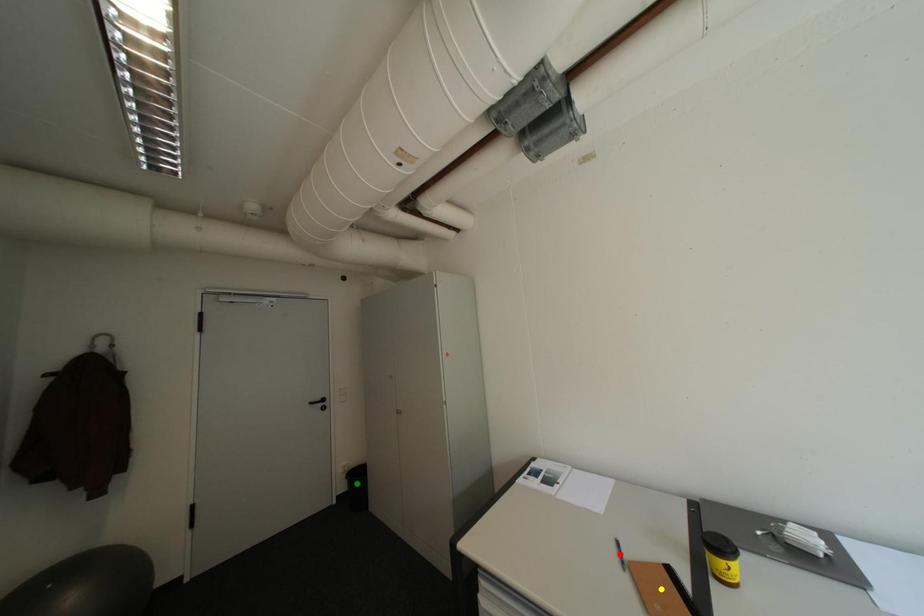
Order these from nearest to farthest:
A) red point
B) yellow point
C) green point

yellow point < red point < green point